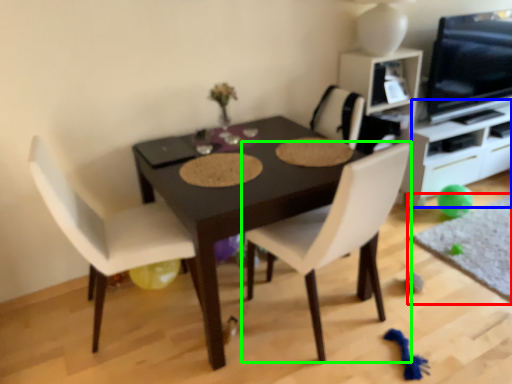
Question: Which object is the closest to the place mat (highlighted by a red box)? Choose among these: entertainment center (highlighted by a blue box) or chair (highlighted by a green box).

Choices:
 (A) entertainment center
 (B) chair

Answer: (A)